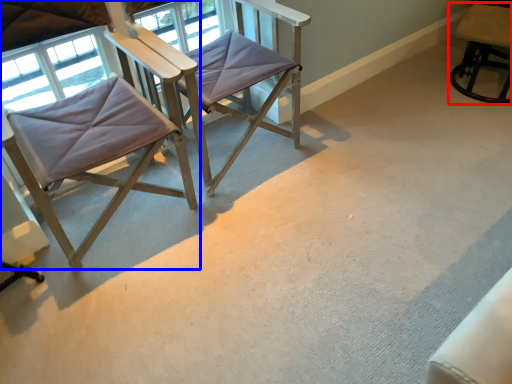
Question: Which point is closer to the camera, chair (highlighted by a red box) or chair (highlighted by a blue box)?

Choices:
 (A) chair
 (B) chair

Answer: (B)